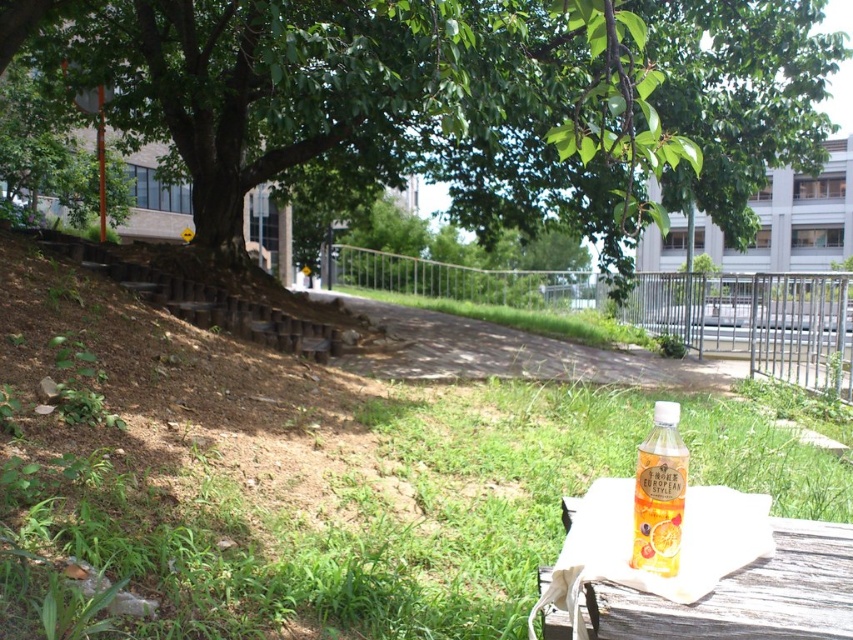
Can you confirm if green leafy tree at upper center is positioned to the right of wooden table at lower right?

In fact, green leafy tree at upper center is to the left of wooden table at lower right.

Between point (712, 177) and point (573, 499), which one is positioned behind?

Positioned behind is point (712, 177).

Identify the location of green leafy tree at upper center. This screenshot has width=853, height=640. (444, 96).

This screenshot has height=640, width=853. In order to click on green leafy tree at upper center in this screenshot , I will do `click(444, 96)`.

Can you confirm if green grass at lower left is shorter than green leafy tree at upper center?

Yes.

Is green grass at lower left thinner than green leafy tree at upper center?

Indeed, green grass at lower left has a lesser width compared to green leafy tree at upper center.

Is point (511, 456) positioned behind point (462, 8)?

That is False.

I want to click on green grass at lower left, so click(x=274, y=476).

Is wooden table at lower right wider than translucent plastic bottle at lower right?

Yes.

From the picture: Between wooden table at lower right and translucent plastic bottle at lower right, which one appears on the left side from the viewer's perspective?

Positioned to the left is translucent plastic bottle at lower right.

I want to click on wooden table at lower right, so click(x=746, y=595).

The image size is (853, 640). In order to click on wooden table at lower right in this screenshot , I will do `click(746, 595)`.